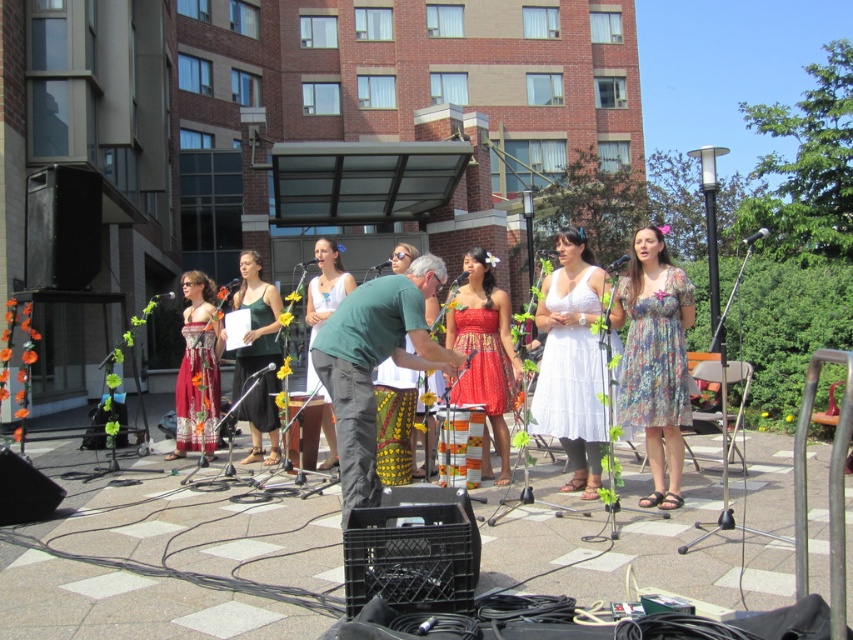
Does floral print dress at center have a smaller size compared to white cotton dress at center?

Indeed, floral print dress at center has a smaller size compared to white cotton dress at center.

Is point (651, 282) positioned in front of point (553, 429)?

Yes, point (651, 282) is in front of point (553, 429).

You are a GUI agent. You are given a task and a screenshot of the screen. Output one action in this format:
    pyautogui.click(x=<x>, y=<y>)
    Task: Click on the floral print dress at center
    The width and height of the screenshot is (853, 640).
    Given the screenshot: What is the action you would take?
    pyautogui.click(x=654, y=358)

Is floral print dress at center further to the viewer compared to green dress at center?

No, floral print dress at center is closer to the viewer.

Can you confirm if floral print dress at center is smaller than green dress at center?

Correct, floral print dress at center occupies less space than green dress at center.

You are a GUI agent. You are given a task and a screenshot of the screen. Output one action in this format:
    pyautogui.click(x=<x>, y=<y>)
    Task: Click on the floral print dress at center
    This screenshot has width=853, height=640.
    Given the screenshot: What is the action you would take?
    pyautogui.click(x=654, y=358)

Does point (691, 288) come closer to viewer compared to point (343, 296)?

That is True.

Is floral print dress at center to the left of green cotton shirt at center from the viewer's perspective?

Incorrect, floral print dress at center is not on the left side of green cotton shirt at center.

Identify the location of floral print dress at center. The image size is (853, 640). (654, 358).

Find the location of `floral print dress at center`. floral print dress at center is located at coordinates (654, 358).